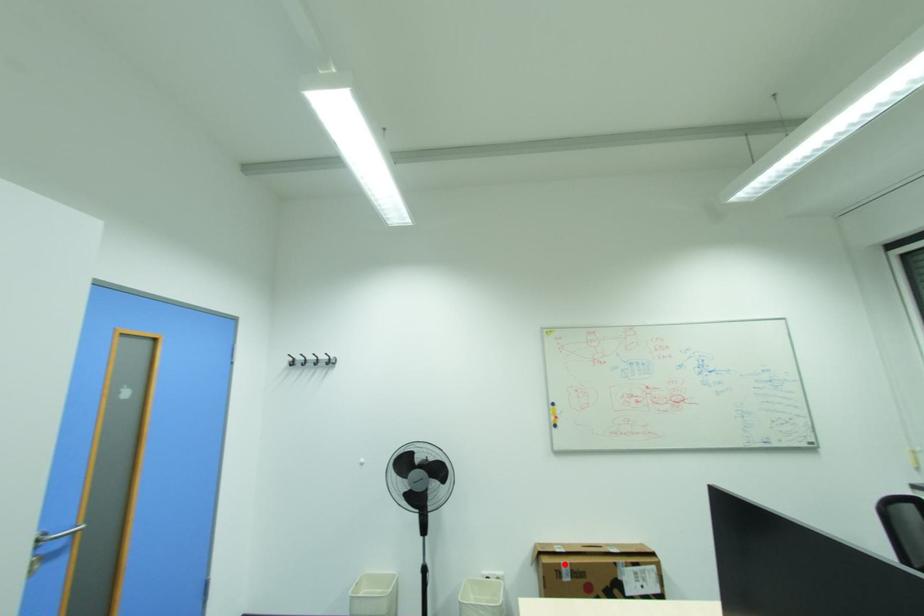
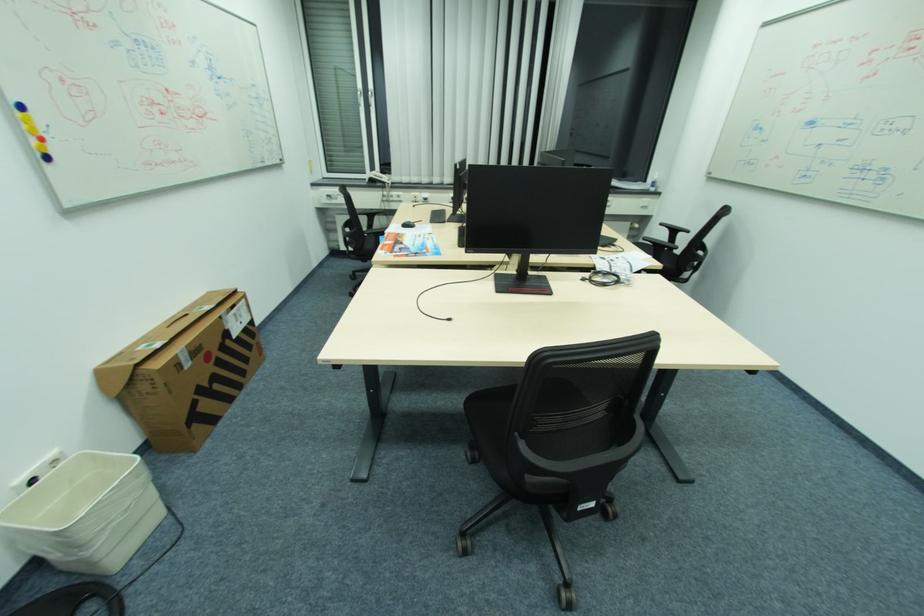
Question: I am providing you with two images of the same scene from different viewpoints. In image1, a red point is highlighted. Considering the same 3D point in image2, which of the following is correct?

Choices:
 (A) It is closer
 (B) It is farther

Answer: (A)